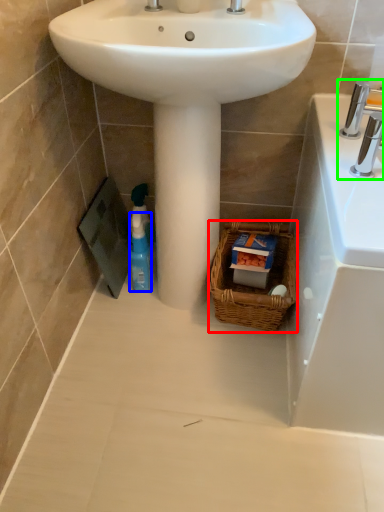
Question: Which is farther away from basket (highlighted by a red box)? cleaning product (highlighted by a blue box) or tap (highlighted by a green box)?

Choices:
 (A) cleaning product
 (B) tap

Answer: (B)